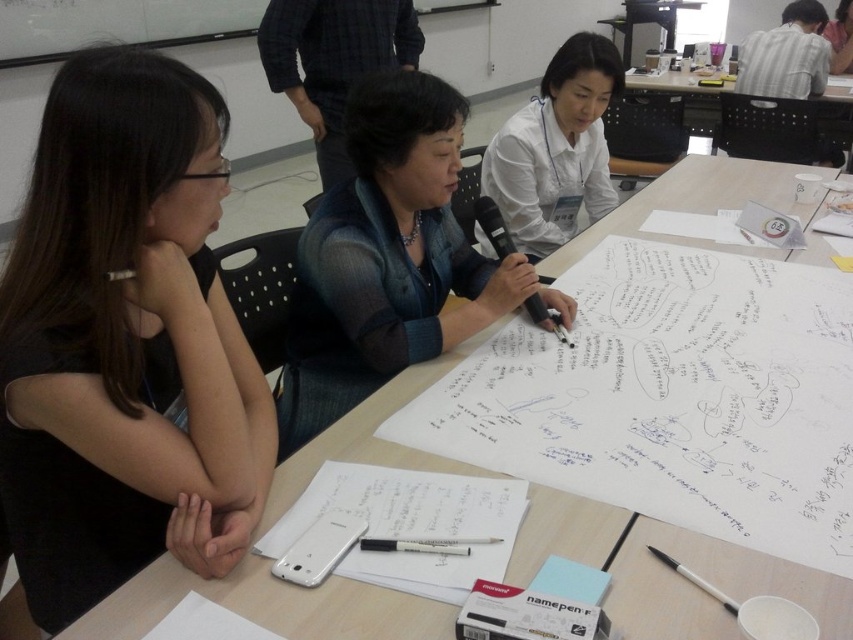
Question: Can you confirm if wooden table at center is smaller than white paper at center?

Choices:
 (A) yes
 (B) no

Answer: (B)

Question: Based on their relative distances, which object is nearer to the black matte shirt at left?

Choices:
 (A) black marker pen at center
 (B) matte blue shirt at center

Answer: (B)

Question: Which point appears closest to the camera in this image?

Choices:
 (A) (241, 358)
 (B) (305, 273)
 (C) (573, 209)
 (D) (436, 540)

Answer: (D)

Question: Which point is closer to the camera?

Choices:
 (A) (3, 346)
 (B) (386, 547)
 (C) (531, 538)

Answer: (A)

Question: Is black matte shirt at left positioned at the back of wooden table at center?

Choices:
 (A) yes
 (B) no

Answer: (B)

Question: Is the position of wooden table at center less distant than that of white glossy shirt at upper center?

Choices:
 (A) yes
 (B) no

Answer: (A)